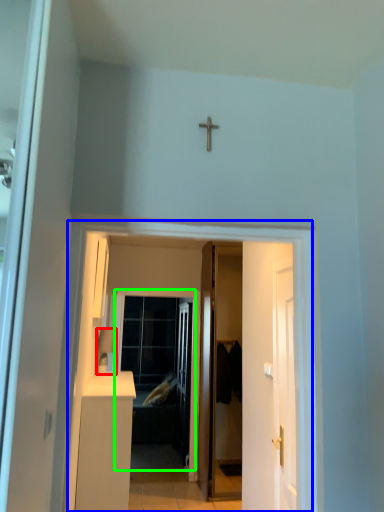
Question: Which is nearer to the lamp (highlighted by a red box)? corridor (highlighted by a blue box) or screen door (highlighted by a green box).

Choices:
 (A) corridor
 (B) screen door

Answer: (A)